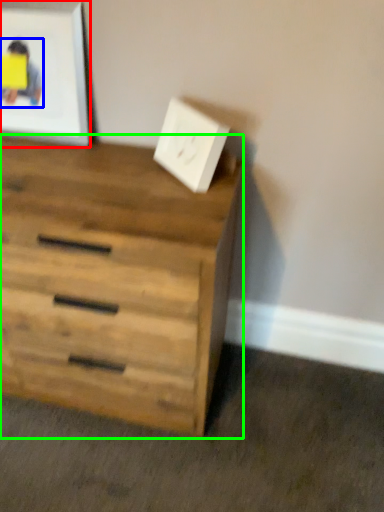
Question: Based on their relative distances, which object is nearer to picture frame (highlighted by a red box)? Choose from person (highlighted by a blue box) and chest of drawers (highlighted by a green box).

Choices:
 (A) person
 (B) chest of drawers

Answer: (A)